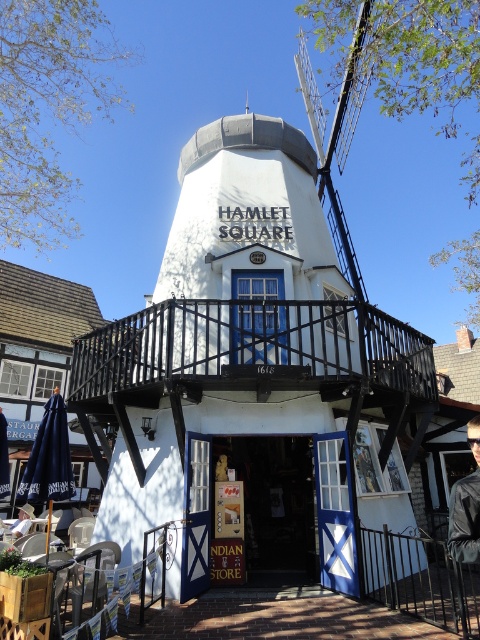
Question: Among these objects, which one is nearest to the camera?

Choices:
 (A) white painted wood windmill at center
 (B) black metal railing at lower right

Answer: (B)

Question: Which of the following is the closest to the observer?

Choices:
 (A) black metal railing at lower right
 (B) white painted wood windmill at center

Answer: (A)

Question: Where is white painted wood windmill at center located in relation to black metal railing at lower right in the image?

Choices:
 (A) left
 (B) right

Answer: (A)

Question: Can you confirm if white painted wood windmill at center is positioned to the left of black metal railing at lower right?

Choices:
 (A) no
 (B) yes

Answer: (B)

Question: Does white painted wood windmill at center have a lesser width compared to black metal railing at lower right?

Choices:
 (A) yes
 (B) no

Answer: (B)